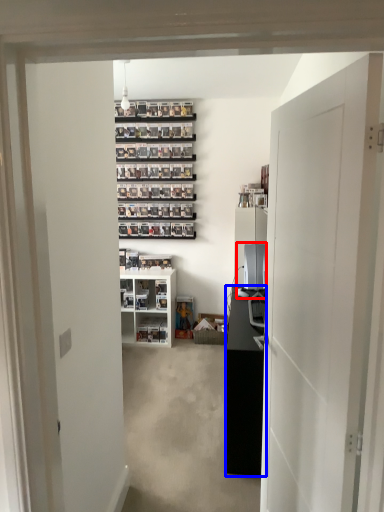
Question: Among these objects, which one is nearest to the camera, desktop computer (highlighted by a red box) or cabinetry (highlighted by a blue box)?

Choices:
 (A) desktop computer
 (B) cabinetry

Answer: (B)